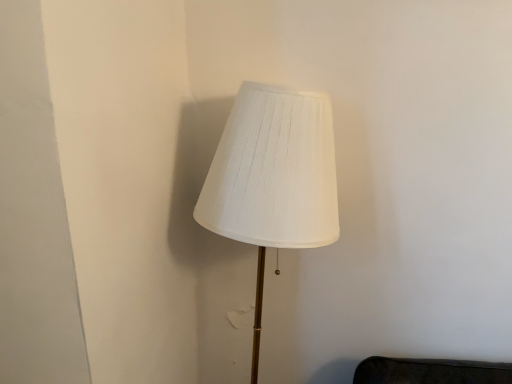
Locate an element on the screen. The width and height of the screenshot is (512, 384). white fabric lampshade at center is located at coordinates (273, 178).

What do you see at coordinates (273, 178) in the screenshot? This screenshot has height=384, width=512. I see `white fabric lampshade at center` at bounding box center [273, 178].

What is the approximate height of white fabric lampshade at center?

white fabric lampshade at center is 3.33 feet in height.

Measure the distance between white fabric lampshade at center and camera.

88.06 centimeters.

Where is `white fabric lampshade at center`? white fabric lampshade at center is located at coordinates (273, 178).